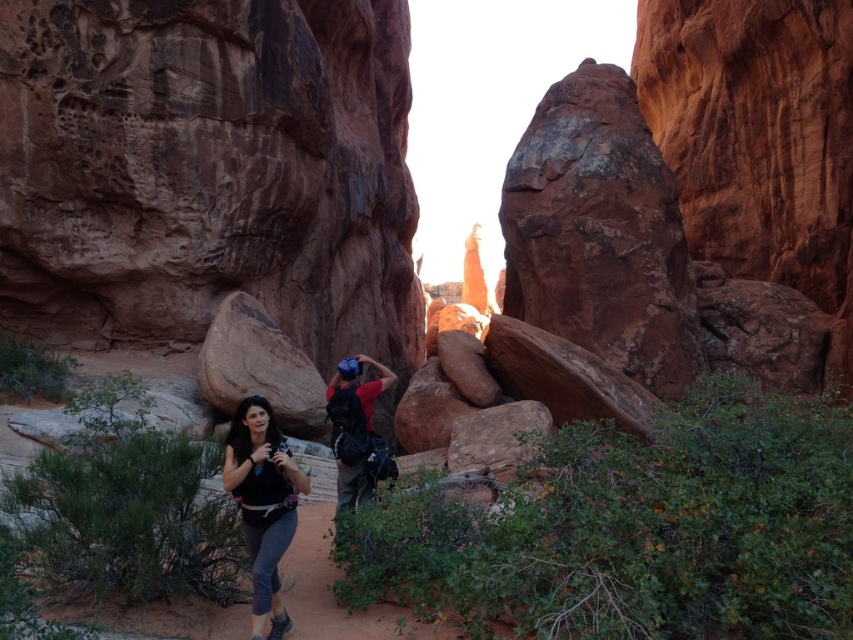
Question: Among these points, which one is nearest to the camera?

Choices:
 (A) (338, 369)
 (B) (234, 433)
 (C) (509, 248)
 (D) (347, 282)

Answer: (B)

Question: Which object is positioned closest to the rustic sandstone boulder at center?

Choices:
 (A) reddish-brown textured rock at center-right
 (B) matte black tank top at center
 (C) matte red shirt at center

Answer: (A)

Question: Can you confirm if reddish-brown textured rock at center-right is positioned above matte black tank top at center?

Choices:
 (A) no
 (B) yes

Answer: (B)

Question: Which object is positioned closest to the matte black tank top at center?

Choices:
 (A) rustic sandstone boulder at center
 (B) reddish-brown textured rock at center-right
 (C) matte red shirt at center

Answer: (C)

Question: Is rustic sandstone boulder at center thinner than matte black tank top at center?

Choices:
 (A) no
 (B) yes

Answer: (A)

Question: Does reddish-brown textured rock at center-right come behind matte red shirt at center?

Choices:
 (A) yes
 (B) no

Answer: (A)